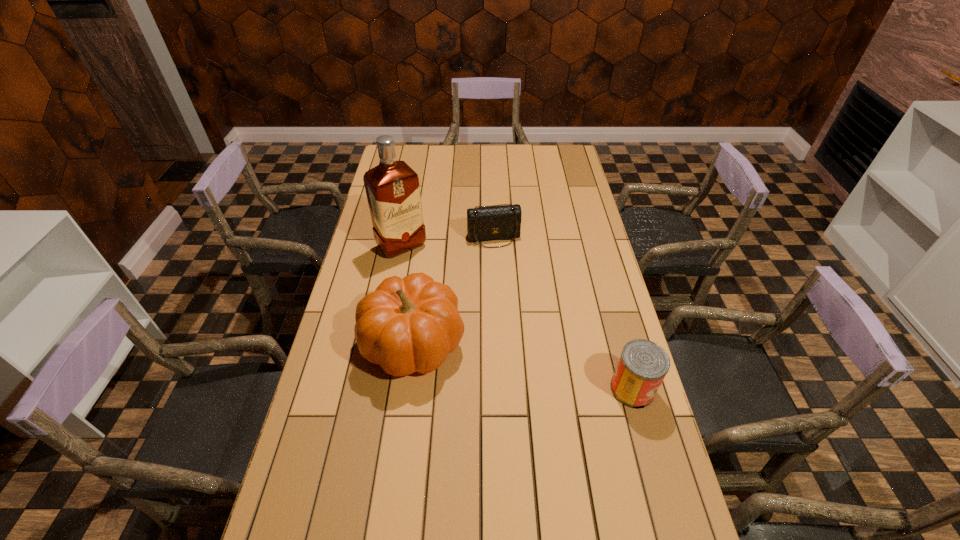
Locate an element on the screen. This screenshot has height=540, width=960. the third shortest object is located at coordinates (410, 324).

Locate an element on the screen. The height and width of the screenshot is (540, 960). can is located at coordinates (643, 364).

Find the location of a particular element. the tallest object is located at coordinates (392, 187).

The image size is (960, 540). I want to click on clutch bag, so (487, 223).

At what (x,y) coordinates should I click in order to perform the action: click on vacant space located on the left of the pumpkin. Please return your answer as a coordinate pair (x, y). The width and height of the screenshot is (960, 540). Looking at the image, I should click on (344, 342).

Find the location of a particular element. free location located on the back of the can is located at coordinates (616, 330).

I want to click on vacant space located 0.220m on the front label of the liquor, so click(x=444, y=296).

Image resolution: width=960 pixels, height=540 pixels. Identify the location of free space located 0.310m on the front label of the liquor. (458, 313).

Locate an element on the screen. The height and width of the screenshot is (540, 960). blank space located on the front label of the liquor is located at coordinates point(451,305).

Find the location of a particular element. The image size is (960, 540). free space located 0.220m on the front flap of the clutch bag is located at coordinates (510, 291).